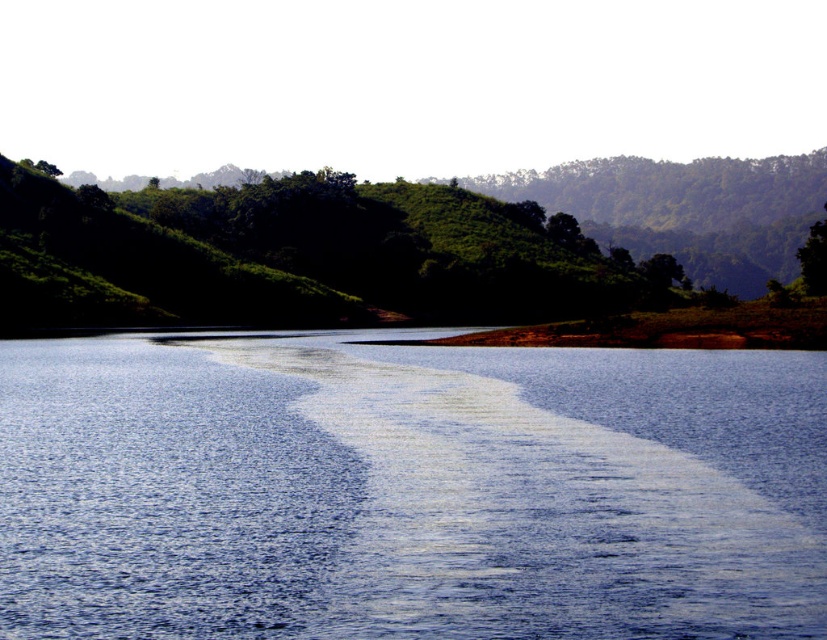
Is point (498, 620) positioned behind point (653, 257)?

That is False.

Who is taller, blue smooth water at center or green leafy tree at upper right?

green leafy tree at upper right is taller.

Identify the location of blue smooth water at center. (407, 488).

Locate an element on the screen. Image resolution: width=827 pixels, height=640 pixels. blue smooth water at center is located at coordinates (407, 488).

Between blue smooth water at center and green leafy hillside at upper center, which one is positioned lower?

Positioned lower is blue smooth water at center.

Between point (241, 456) and point (792, 168), which one is positioned behind?

The point (792, 168) is more distant.

Describe the element at coordinates (407, 488) in the screenshot. I see `blue smooth water at center` at that location.

Locate an element on the screen. blue smooth water at center is located at coordinates (407, 488).

Which of these two, green leafy hillside at upper center or green leafy tree at upper right, stands shorter?

Standing shorter between the two is green leafy tree at upper right.

Image resolution: width=827 pixels, height=640 pixels. What are the coordinates of `green leafy hillside at upper center` in the screenshot? It's located at (686, 209).

Measure the distance between point (696,232) and camera.

Point (696,232) and camera are 2047.23 feet apart.

Image resolution: width=827 pixels, height=640 pixels. Find the location of `green leafy hillside at upper center`. green leafy hillside at upper center is located at coordinates (686, 209).